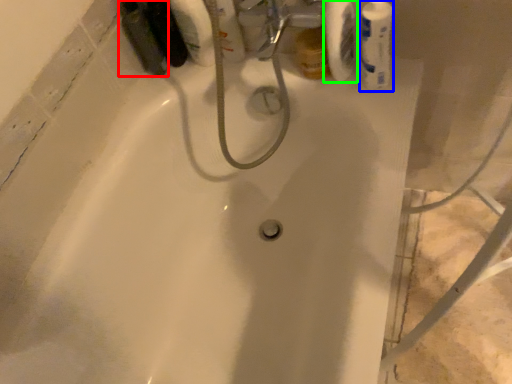
Question: Considering the real-world distances, which object is farthest from mouthwash (highlighted by a red box)? mouthwash (highlighted by a blue box) or toilet paper (highlighted by a green box)?

Choices:
 (A) mouthwash
 (B) toilet paper

Answer: (A)